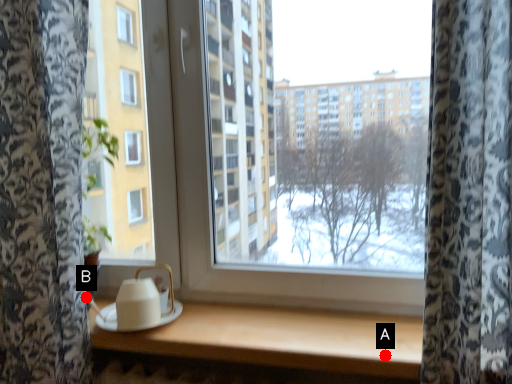
Question: Two points are circled on the image, labeled by A and B beside each circle. Which of the following is the farthest from the observer?

Choices:
 (A) A is further
 (B) B is further

Answer: (B)